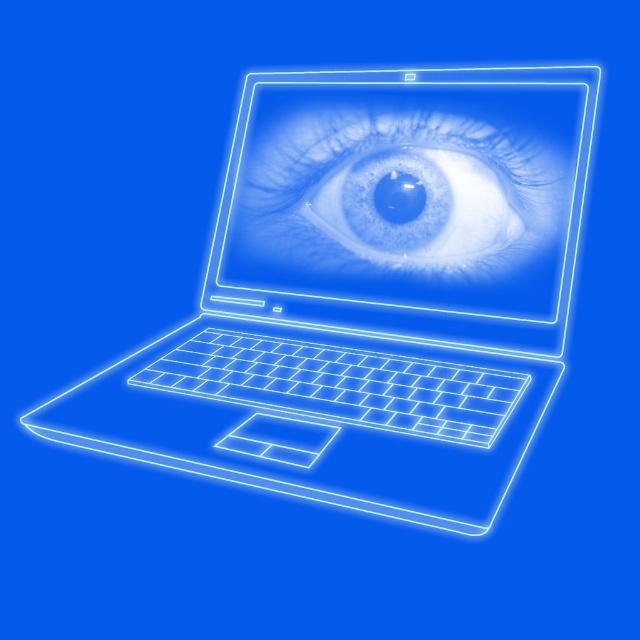
Question: Can you confirm if neon white laptop at center is positioned to the left of translucent blue eye at center?

Choices:
 (A) yes
 (B) no

Answer: (A)

Question: Is neon white laptop at center thinner than translucent blue eye at center?

Choices:
 (A) no
 (B) yes

Answer: (A)

Question: Is neon white laptop at center smaller than translucent blue eye at center?

Choices:
 (A) yes
 (B) no

Answer: (B)